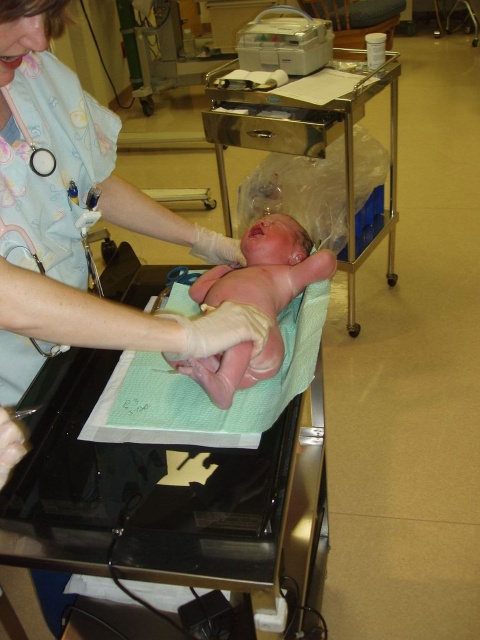
You are a nurse in the hospital and need to locate the medical supplies stored at point (312, 147). Based on the scene description, where exactly is this point located?

The point (312, 147) is on the stainless steel cart at upper center, which is likely where the medical supplies are stored.

You are a medical assistant who needs to retrieve a medical kit from the stainless steel cart at upper center while holding the pink smooth newborn at center. Can you safely reach the cart without letting go of the baby?

The distance between the stainless steel cart at upper center and the pink smooth newborn at center is 1.18 meters. Since the medical assistant is holding the baby, they would need to extend their arm to reach the cart. However, 1.18 meters is beyond typical arm reach, so it might not be safe to attempt without assistance.